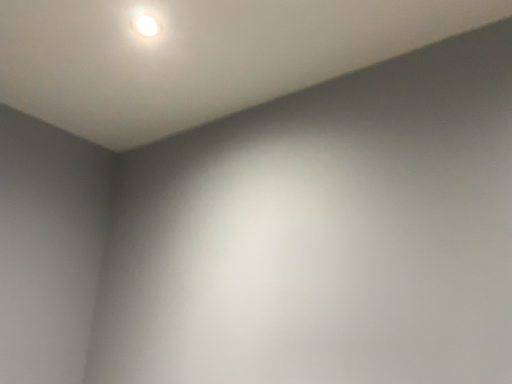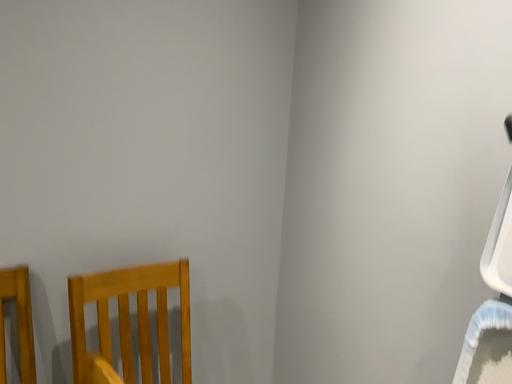
Question: Which way did the camera rotate in the video?

Choices:
 (A) rotated downward
 (B) rotated upward

Answer: (A)